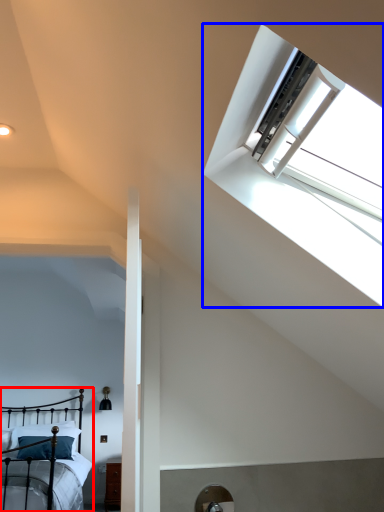
Question: Among these objects, which one is farthest to the camera, bed (highlighted by a red box) or window (highlighted by a blue box)?

Choices:
 (A) bed
 (B) window

Answer: (A)